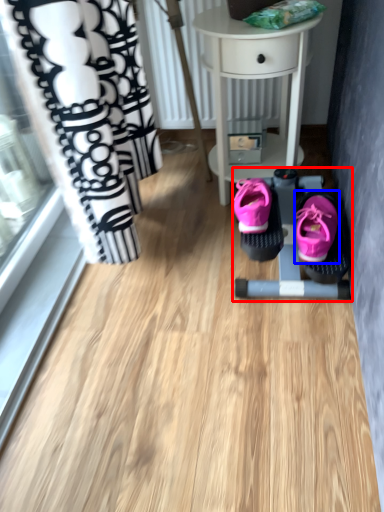
Question: Which object appears closest to the camera in this image, baby carriage (highlighted by a red box) or footwear (highlighted by a blue box)?

Choices:
 (A) baby carriage
 (B) footwear

Answer: (B)